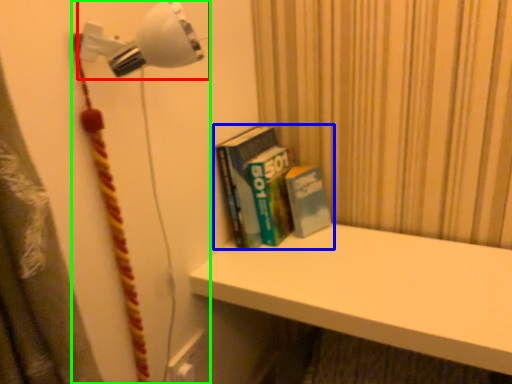
Question: Estimate the real-world distances between objects in this image. Which object is farther from lamp (highlighted by a red box), book (highlighted by a blue box) or lamp (highlighted by a green box)?

Choices:
 (A) book
 (B) lamp

Answer: (A)